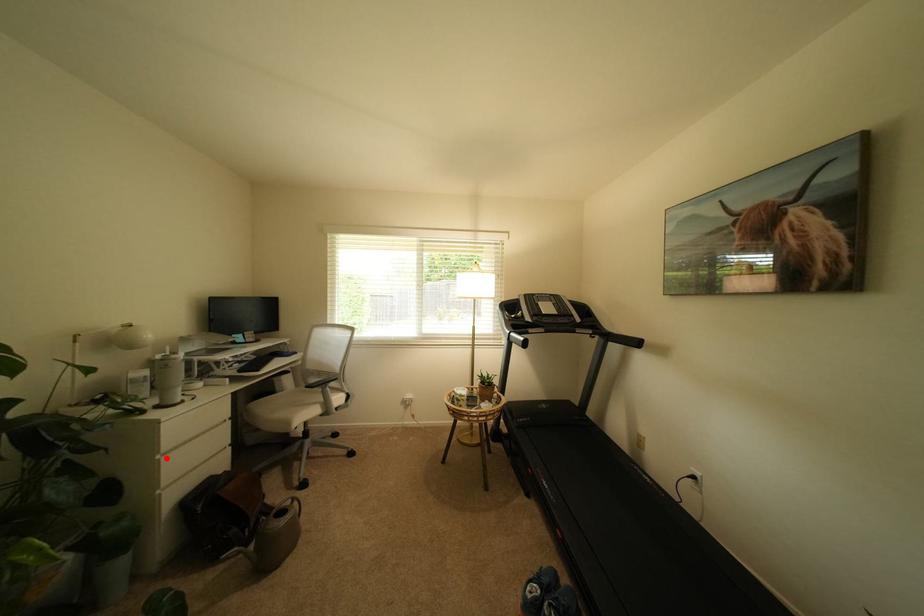
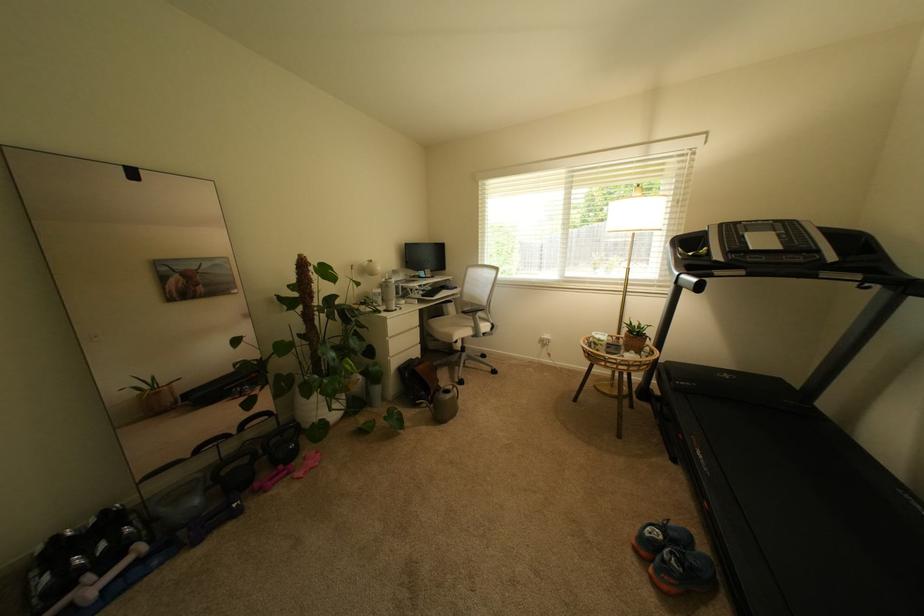
The point at the highlighted location is marked in the first image. Where is the corresponding point in the second image?

(395, 339)